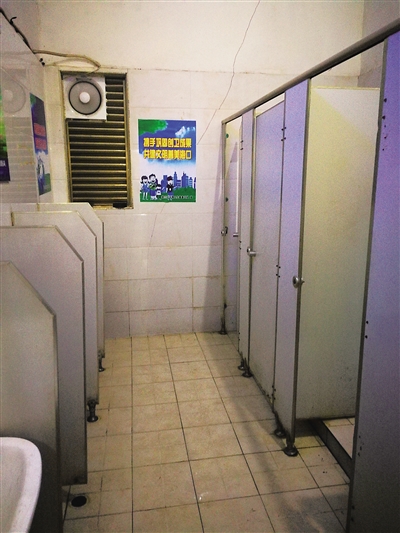
The width and height of the screenshot is (400, 533). Identify the location of ceiling. (206, 51).